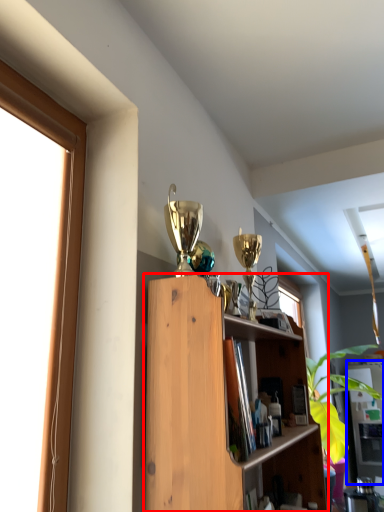
Question: Among these objects, which one is farthest to the camera, shelf (highlighted by a red box) or cabinet (highlighted by a blue box)?

Choices:
 (A) shelf
 (B) cabinet

Answer: (B)